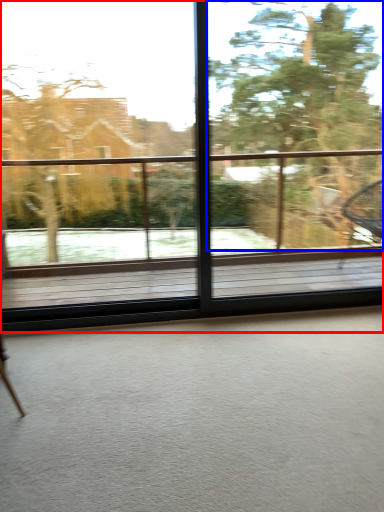
Question: Among these objects, which one is nearest to the camera, window (highlighted by a red box) or tree (highlighted by a blue box)?

Choices:
 (A) window
 (B) tree

Answer: (A)